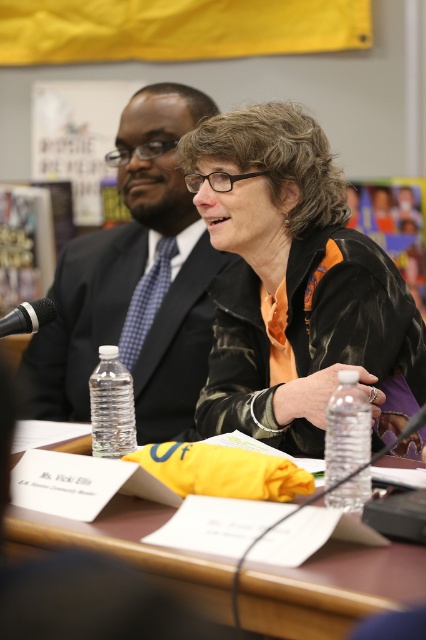
Can you confirm if blue checkered tie at center is bigger than black metallic microphone at left?

Yes.

Can you confirm if blue checkered tie at center is smaller than black metallic microphone at left?

Actually, blue checkered tie at center might be larger than black metallic microphone at left.

The height and width of the screenshot is (640, 426). I want to click on blue checkered tie at center, so click(146, 301).

Locate an element on the screen. The image size is (426, 640). blue checkered tie at center is located at coordinates (146, 301).

Who is shorter, matte black suit at center or black metallic microphone at left?

With less height is black metallic microphone at left.

Who is lower down, matte black suit at center or black metallic microphone at left?

Positioned lower is black metallic microphone at left.

Is point (94, 326) positioned after point (13, 324)?

That is True.

Where is `matte black suit at center`? This screenshot has width=426, height=640. matte black suit at center is located at coordinates (135, 282).

Between matte black jacket at center and brown wooden table at center, which one appears on the right side from the viewer's perspective?

matte black jacket at center is more to the right.

Which is in front, point (236, 300) or point (256, 570)?

Point (256, 570)

The height and width of the screenshot is (640, 426). In order to click on matte black jacket at center in this screenshot , I will do (x=293, y=284).